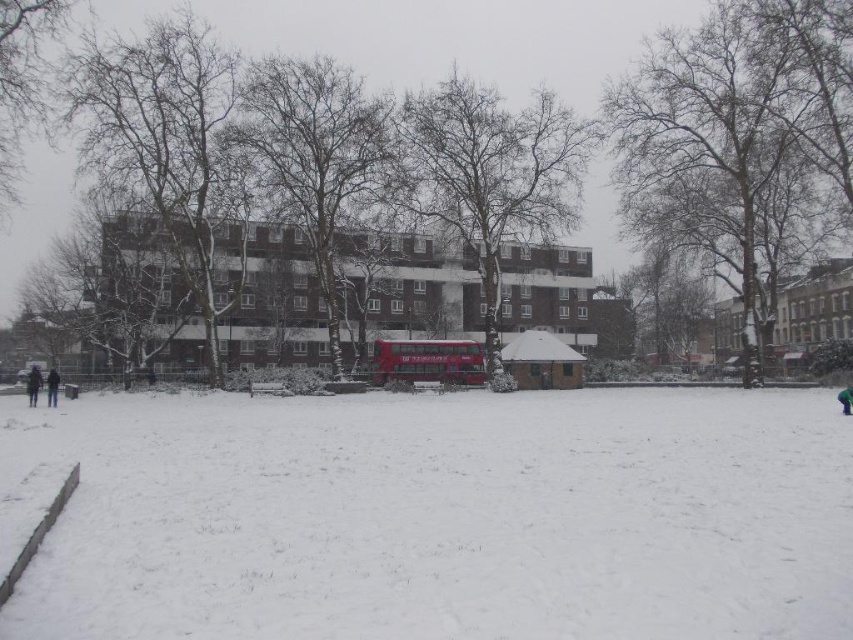
You are standing at the point with coordinates point (47, 396) and want to walk to the point with coordinates point (804, 390). Based on the scene description, will you be able to see the destination point from your current position?

Since point (804, 390) is behind point (47, 396), you will not be able to see the destination point from your current position.

Consider the image. You are a pedestrian trying to reach the brown wooden bus stop at center from the dark blue jacket at lower left. Is the bus stop closer to you or farther away?

The brown wooden bus stop at center is smaller than the dark blue jacket at lower left, which typically indicates it is farther away. Therefore, the bus stop is farther away from you.